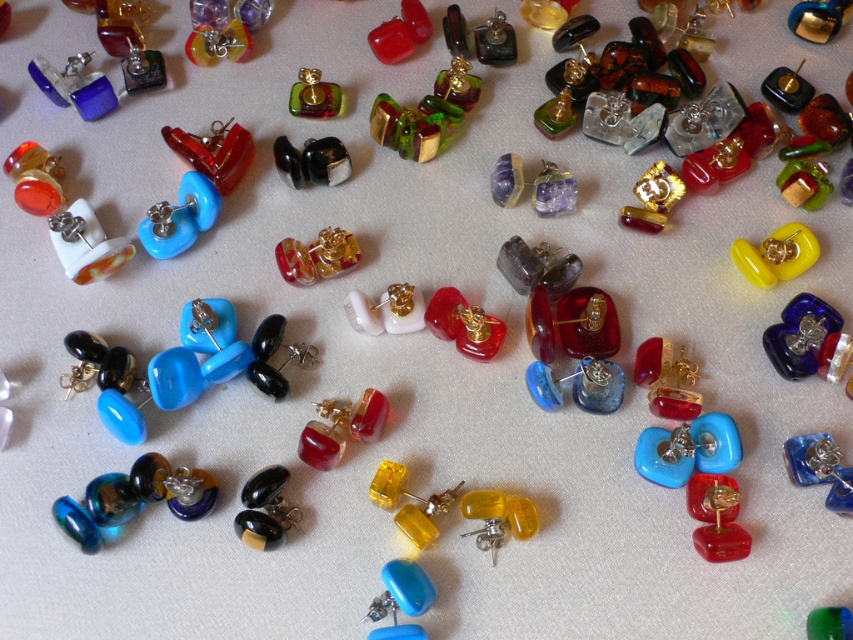
Question: Which of these objects is positioned farthest from the yellow translucent earrings at upper right?

Choices:
 (A) translucent amber glass earrings at center
 (B) glossy red stone at center

Answer: (A)

Question: Is black glossy earrings at center closer to the viewer compared to matte red glass earring at center?

Choices:
 (A) yes
 (B) no

Answer: (A)

Question: Is yellow translucent earrings at upper right closer to camera compared to translucent amber glass earrings at center?

Choices:
 (A) yes
 (B) no

Answer: (A)

Question: Which point is closer to the camera?

Choices:
 (A) black glossy earrings at center
 (B) matte red glass earring at center
 (C) glossy red stone at center

Answer: (A)

Question: Can you confirm if glossy red stone at center is thinner than green glass earring at center?

Choices:
 (A) no
 (B) yes

Answer: (A)

Question: Considering the real-world distances, which object is farthest from the green glass earring at center?

Choices:
 (A) matte red glass earring at center
 (B) yellow translucent earrings at upper right
 (C) glossy red stone at center
 (D) black glossy earrings at center

Answer: (B)